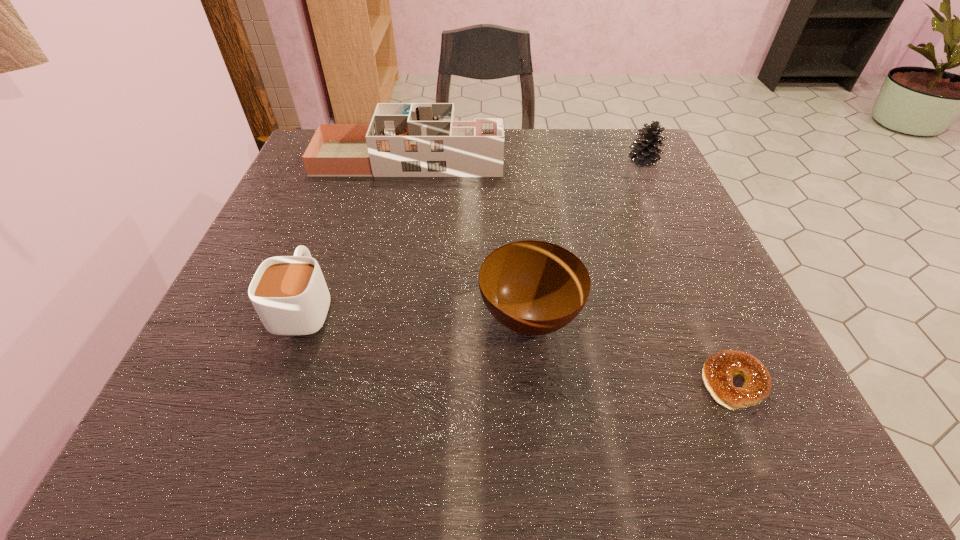
Locate an element on the screen. The image size is (960, 540). blank space located 0.090m on the side with the handle of the cup is located at coordinates (328, 240).

Locate an element on the screen. The image size is (960, 540). vacant area situated on the back of the bagel is located at coordinates (678, 258).

In order to click on pinecone that is at the far edge in this screenshot , I will do `click(645, 152)`.

You are a GUI agent. You are given a task and a screenshot of the screen. Output one action in this format:
    pyautogui.click(x=<x>, y=<y>)
    Task: Click on the dollhouse that is positioned at the far edge
    
    Given the screenshot: What is the action you would take?
    pyautogui.click(x=403, y=139)

The height and width of the screenshot is (540, 960). I want to click on object that is at the near edge, so click(x=719, y=369).

I want to click on dollhouse situated at the left edge, so click(403, 139).

I want to click on cup positioned at the left edge, so (x=289, y=293).

The height and width of the screenshot is (540, 960). I want to click on pinecone situated at the right edge, so click(645, 152).

You are a GUI agent. You are given a task and a screenshot of the screen. Output one action in this format:
    pyautogui.click(x=<x>, y=<y>)
    Task: Click on the bagel that is at the right edge
    
    Given the screenshot: What is the action you would take?
    pyautogui.click(x=719, y=369)

Where is `object present at the far left corner`? object present at the far left corner is located at coordinates (403, 139).